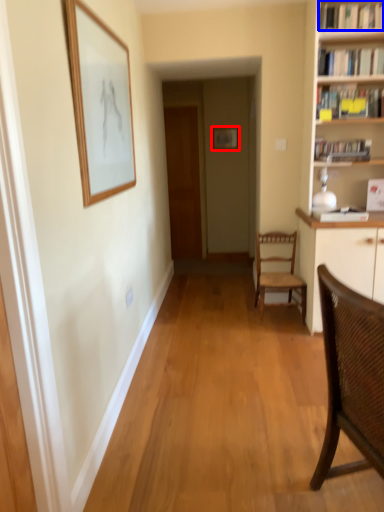
Question: Among these objects, which one is nearest to the camera, picture frame (highlighted by a red box) or book (highlighted by a blue box)?

Choices:
 (A) picture frame
 (B) book

Answer: (B)